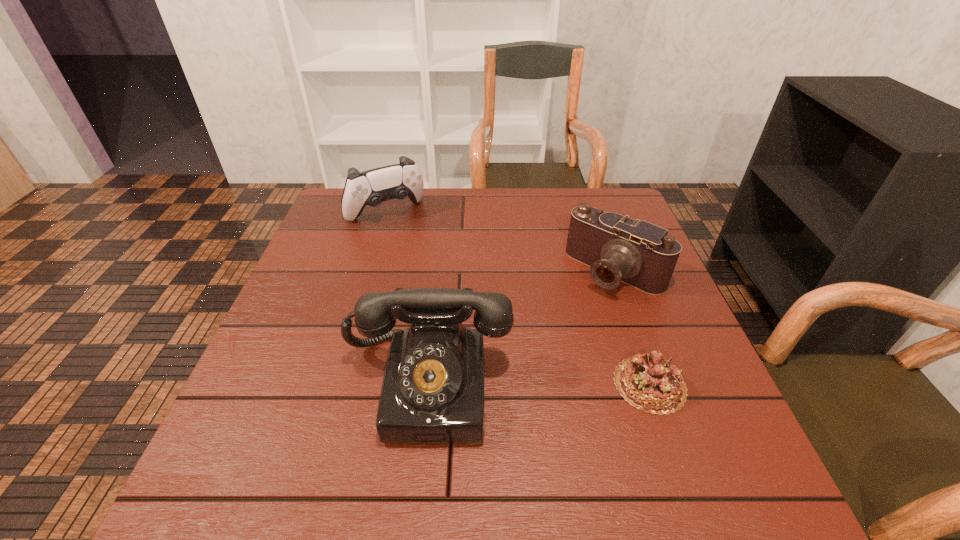
What are the coordinates of `blank region between the second farthest object and the control` in the screenshot? It's located at (500, 242).

I want to click on free area in between the farthest object and the second farthest object, so click(500, 242).

Find the location of a particular element. free area in between the tallest object and the shortest object is located at coordinates 539,384.

This screenshot has height=540, width=960. What are the coordinates of `object that ranks as the second closest to the third nearest object` in the screenshot? It's located at (432, 392).

I want to click on object that is the second closest to the camera, so click(x=432, y=392).

The height and width of the screenshot is (540, 960). I want to click on vacant position in the image that satisfies the following two spatial constraints: 1. on the front side of the control; 2. on the left side of the shortest object, so 335,384.

In order to click on vacant space that satisfies the following two spatial constraints: 1. on the front side of the camera; 2. on the left side of the control in this screenshot , I will do `click(369, 271)`.

Identify the location of free space in the image that satisfies the following two spatial constraints: 1. on the front side of the chocolate cake; 2. on the left side of the farthest object. The image size is (960, 540). (335, 384).